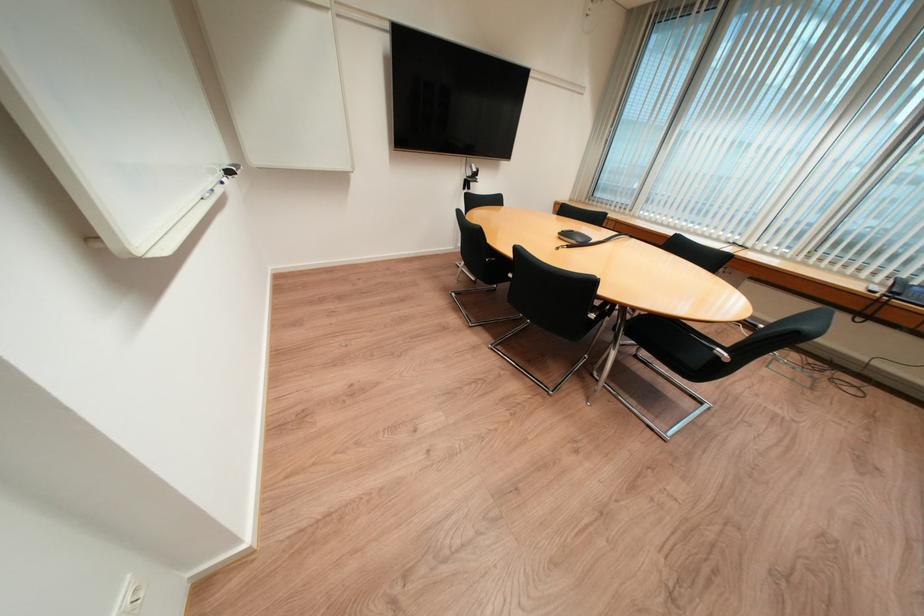
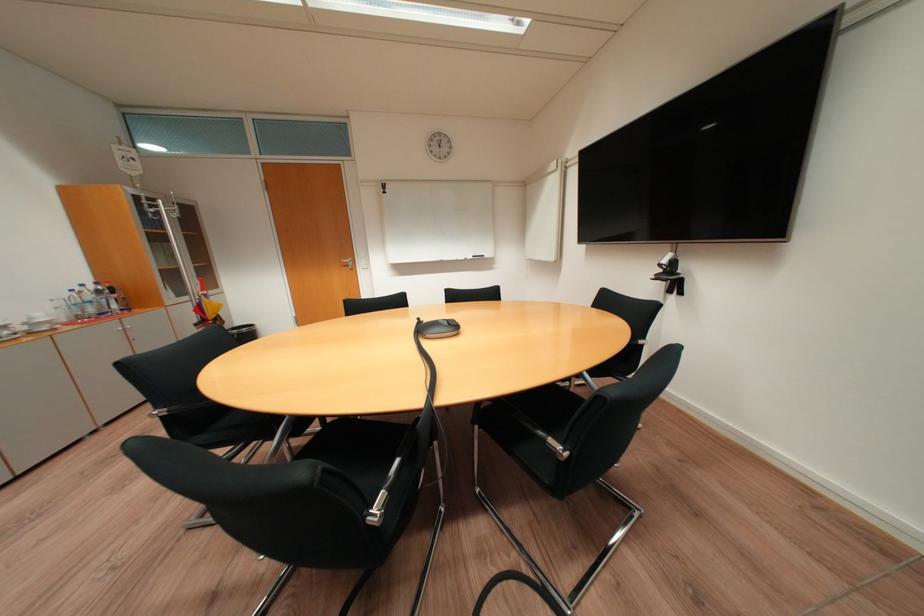
Question: I am providing you with two images of the same scene from different viewpoints. Which of the following objects are not visible in image2?

Choices:
 (A) whiteboard eraser
 (B) plastic water bottle
 (C) black chair sitting surface
 (D) black plastic basket

Answer: (C)